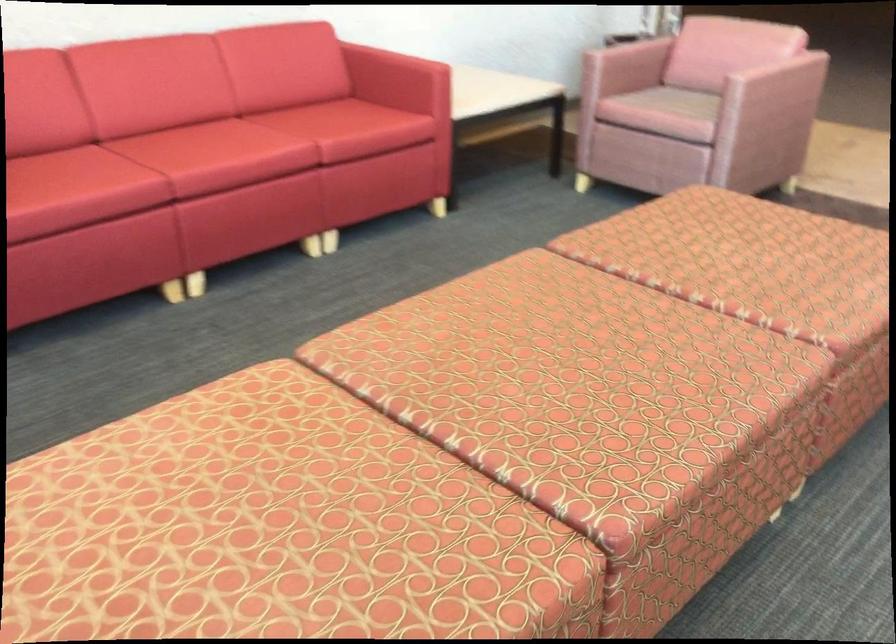
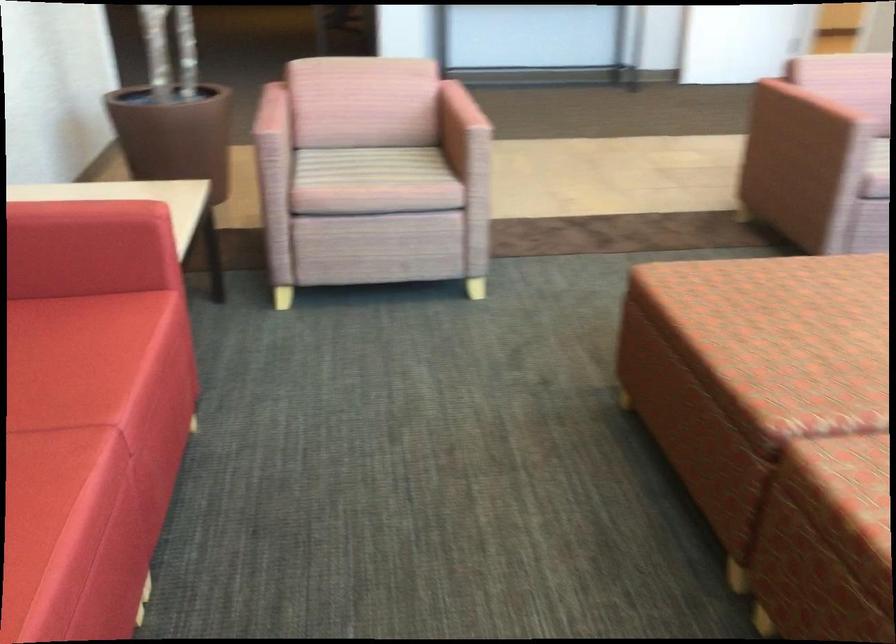
Locate, in the second image, the point that corresponds to point 664,97 in the first image.

(365, 166)